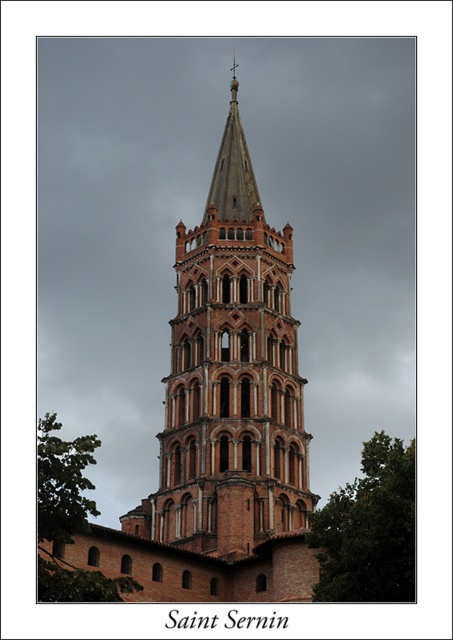
You are standing in a park and see the brown brick tower at center and the green leafy tree at lower right. Which object is closer to you based on their positions?

The brown brick tower at center is closer to you because the green leafy tree at lower right is positioned behind it.

You are standing in a park and see the brown brick tower at center and the green leafy tree at lower left. Which object is higher in the scene?

The brown brick tower at center is higher than the green leafy tree at lower left because it is positioned above it in the scene.